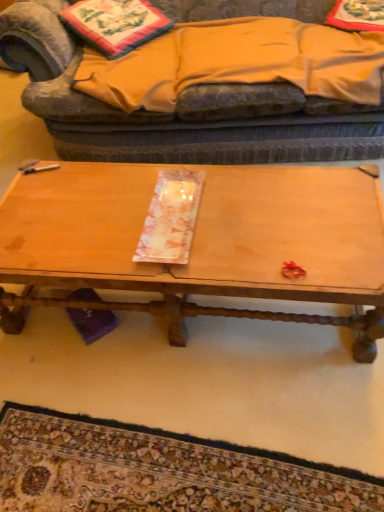
What are the coordinates of `free location in front of wooden tray at center` in the screenshot? It's located at (223, 390).